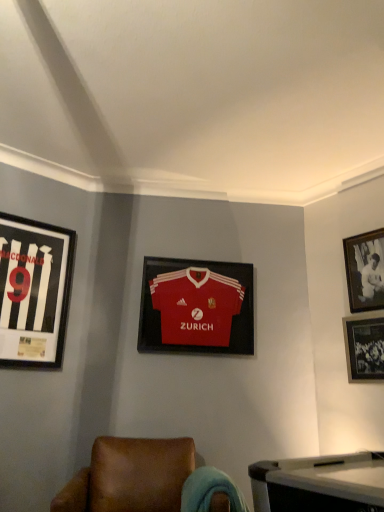
Question: Is black glossy photo frame at upper right, the 4th picture frame from the left, in front of or behind black glossy photo frame at lower right, the 2th picture frame in the right-to-left sequence, in the image?

Choices:
 (A) front
 (B) behind

Answer: (B)

Question: From a real-world perspective, is black glossy photo frame at upper right, the 4th picture frame from the left, above or below black glossy photo frame at lower right, which appears as the 3th picture frame when viewed from the left?

Choices:
 (A) above
 (B) below

Answer: (A)

Question: Estimate the real-world distances between objects in this image. Which object is farther from the black glossy photo frame at upper right, placed as the first picture frame when sorted from right to left?

Choices:
 (A) matte red jersey at center, which is the second picture frame in left-to-right order
 (B) brown leather chair at lower center
 (C) black glossy photo frame at lower right, which appears as the 3th picture frame when viewed from the left
 (D) black matte jersey at left, acting as the fourth picture frame starting from the right

Answer: (D)

Question: Which is farther from the matte red jersey at center, acting as the third picture frame starting from the right?

Choices:
 (A) black glossy photo frame at upper right, placed as the first picture frame when sorted from right to left
 (B) black glossy photo frame at lower right, which appears as the 3th picture frame when viewed from the left
 (C) black matte jersey at left, acting as the fourth picture frame starting from the right
 (D) brown leather chair at lower center

Answer: (A)